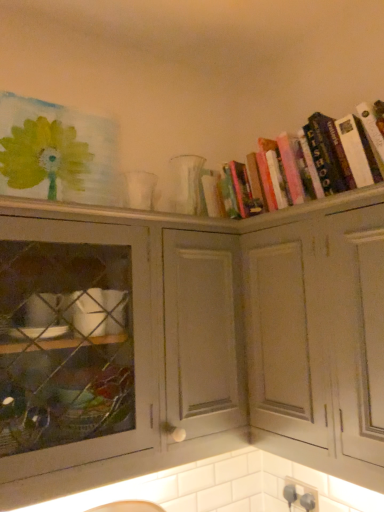
Identify the location of white matte cabinet at upper right, the first cabinetry from the right. The width and height of the screenshot is (384, 512). (318, 341).

Is white matte cabinet at upper right, the first cabinetry from the right, facing towards hardcover books at upper right?

No, white matte cabinet at upper right, the first cabinetry from the right, is not aimed at hardcover books at upper right.

Which object is thinner, white matte cabinet at upper right, which is counted as the 2th cabinetry, starting from the left, or hardcover books at upper right?

With smaller width is hardcover books at upper right.

Between point (273, 435) and point (286, 199), which one is positioned in front?

The point (273, 435) is closer to the camera.

Image resolution: width=384 pixels, height=512 pixels. In the image, there is a white matte cabinet at upper right, which is counted as the 2th cabinetry, starting from the left. What are the coordinates of `book above it (from the image's perspective)` in the screenshot? It's located at click(308, 165).

Are matte gray cabinet at center, which ranks as the second cabinetry in right-to-left order, and white matte cabinet at upper right, which is counted as the 2th cabinetry, starting from the left, beside each other?

Yes, matte gray cabinet at center, which ranks as the second cabinetry in right-to-left order, is touching white matte cabinet at upper right, which is counted as the 2th cabinetry, starting from the left.

Considering the sizes of matte gray cabinet at center, which ranks as the second cabinetry in right-to-left order, and white matte cabinet at upper right, which is counted as the 2th cabinetry, starting from the left, in the image, is matte gray cabinet at center, which ranks as the second cabinetry in right-to-left order, taller or shorter than white matte cabinet at upper right, which is counted as the 2th cabinetry, starting from the left,?

In the image, matte gray cabinet at center, which ranks as the second cabinetry in right-to-left order, appears to be shorter than white matte cabinet at upper right, which is counted as the 2th cabinetry, starting from the left.

Is matte gray cabinet at center, which ranks as the second cabinetry in right-to-left order, behind white matte cabinet at upper right, which is counted as the 2th cabinetry, starting from the left?

That is True.

In terms of width, does matte gray cabinet at center, which ranks as the first cabinetry in left-to-right order, look wider or thinner when compared to hardcover books at upper right?

Clearly, matte gray cabinet at center, which ranks as the first cabinetry in left-to-right order, has more width compared to hardcover books at upper right.

Would you say matte gray cabinet at center, which ranks as the first cabinetry in left-to-right order, is outside hardcover books at upper right?

That's correct, matte gray cabinet at center, which ranks as the first cabinetry in left-to-right order, is outside of hardcover books at upper right.

From the image's perspective, which one is positioned lower, matte gray cabinet at center, which ranks as the first cabinetry in left-to-right order, or hardcover books at upper right?

matte gray cabinet at center, which ranks as the first cabinetry in left-to-right order, appears lower in the image.

Considering the positions of objects matte gray cabinet at center, which ranks as the first cabinetry in left-to-right order, and hardcover books at upper right in the image provided, who is more to the right, matte gray cabinet at center, which ranks as the first cabinetry in left-to-right order, or hardcover books at upper right?

Positioned to the right is hardcover books at upper right.

Are hardcover books at upper right and matte gray cabinet at center, which ranks as the second cabinetry in right-to-left order, far apart?

hardcover books at upper right is near matte gray cabinet at center, which ranks as the second cabinetry in right-to-left order, not far away.

Between hardcover books at upper right and matte gray cabinet at center, which ranks as the second cabinetry in right-to-left order, which one has less height?

Standing shorter between the two is hardcover books at upper right.

Considering the sizes of objects hardcover books at upper right and matte gray cabinet at center, which ranks as the first cabinetry in left-to-right order, in the image provided, who is thinner, hardcover books at upper right or matte gray cabinet at center, which ranks as the first cabinetry in left-to-right order,?

hardcover books at upper right is thinner.

Could you measure the distance between hardcover books at upper right and matte gray cabinet at center, which ranks as the first cabinetry in left-to-right order?

hardcover books at upper right and matte gray cabinet at center, which ranks as the first cabinetry in left-to-right order, are 12.44 inches apart.

Which object is closer to the camera taking this photo, hardcover books at upper right or white matte cabinet at upper right, the first cabinetry from the right?

white matte cabinet at upper right, the first cabinetry from the right.

Is hardcover books at upper right located outside white matte cabinet at upper right, which is counted as the 2th cabinetry, starting from the left?

Yes.

Is hardcover books at upper right smaller than white matte cabinet at upper right, the first cabinetry from the right?

Yes, hardcover books at upper right is smaller than white matte cabinet at upper right, the first cabinetry from the right.

From a real-world perspective, is hardcover books at upper right beneath white matte cabinet at upper right, the first cabinetry from the right?

No.

Is white matte cabinet at upper right, which is counted as the 2th cabinetry, starting from the left, looking in the opposite direction of matte gray cabinet at center, which ranks as the first cabinetry in left-to-right order?

white matte cabinet at upper right, which is counted as the 2th cabinetry, starting from the left, is not turned away from matte gray cabinet at center, which ranks as the first cabinetry in left-to-right order.

Is point (262, 414) positioned in front of point (57, 217)?

That is False.

Between white matte cabinet at upper right, the first cabinetry from the right, and matte gray cabinet at center, which ranks as the second cabinetry in right-to-left order, which one appears on the right side from the viewer's perspective?

From the viewer's perspective, white matte cabinet at upper right, the first cabinetry from the right, appears more on the right side.

Locate an element on the screen. This screenshot has width=384, height=512. cabinetry in front of the matte gray cabinet at center, which ranks as the second cabinetry in right-to-left order is located at coordinates (318, 341).

Identify the location of book located on the right of white matte cabinet at upper right, the first cabinetry from the right. (308, 165).

At what (x,y) coordinates should I click in order to perform the action: click on cabinetry below the white matte cabinet at upper right, which is counted as the 2th cabinetry, starting from the left (from the image's perspective). Please return your answer as a coordinate pair (x, y). Looking at the image, I should click on (237, 340).

From the image, which object appears to be farther from hardcover books at upper right, white matte cabinet at upper right, the first cabinetry from the right, or matte gray cabinet at center, which ranks as the second cabinetry in right-to-left order?

matte gray cabinet at center, which ranks as the second cabinetry in right-to-left order.

From the image, which object appears to be nearer to matte gray cabinet at center, which ranks as the first cabinetry in left-to-right order, hardcover books at upper right or white matte cabinet at upper right, the first cabinetry from the right?

Based on the image, white matte cabinet at upper right, the first cabinetry from the right, appears to be nearer to matte gray cabinet at center, which ranks as the first cabinetry in left-to-right order.

Estimate the real-world distances between objects in this image. Which object is further from white matte cabinet at upper right, which is counted as the 2th cabinetry, starting from the left, hardcover books at upper right or matte gray cabinet at center, which ranks as the second cabinetry in right-to-left order?

The object further to white matte cabinet at upper right, which is counted as the 2th cabinetry, starting from the left, is hardcover books at upper right.

Based on their spatial positions, is matte gray cabinet at center, which ranks as the first cabinetry in left-to-right order, or white matte cabinet at upper right, the first cabinetry from the right, closer to hardcover books at upper right?

white matte cabinet at upper right, the first cabinetry from the right, is closer to hardcover books at upper right.

Based on their spatial positions, is white matte cabinet at upper right, which is counted as the 2th cabinetry, starting from the left, or hardcover books at upper right further from matte gray cabinet at center, which ranks as the first cabinetry in left-to-right order?

hardcover books at upper right lies further to matte gray cabinet at center, which ranks as the first cabinetry in left-to-right order, than the other object.

Considering their positions, is matte gray cabinet at center, which ranks as the second cabinetry in right-to-left order, positioned closer to white matte cabinet at upper right, which is counted as the 2th cabinetry, starting from the left, than hardcover books at upper right?

matte gray cabinet at center, which ranks as the second cabinetry in right-to-left order, is closer to white matte cabinet at upper right, which is counted as the 2th cabinetry, starting from the left.

Where is `cabinetry between matte gray cabinet at center, which ranks as the first cabinetry in left-to-right order, and hardcover books at upper right from left to right`? The height and width of the screenshot is (512, 384). cabinetry between matte gray cabinet at center, which ranks as the first cabinetry in left-to-right order, and hardcover books at upper right from left to right is located at coordinates (318, 341).